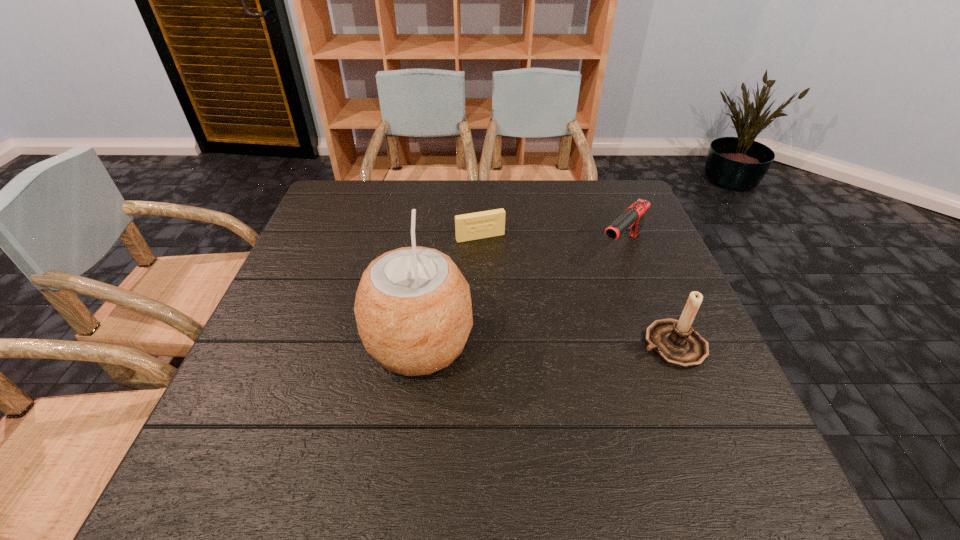
This screenshot has width=960, height=540. I want to click on vacant area that lies between the coconut and the candle holder, so click(x=546, y=343).

Find the location of a particular element. The height and width of the screenshot is (540, 960). free space between the gun and the videotape is located at coordinates (551, 242).

Where is `vacant space in between the gun and the second tallest object`? The height and width of the screenshot is (540, 960). vacant space in between the gun and the second tallest object is located at coordinates (647, 296).

Identify the location of vacant space that's between the shortest object and the candle holder. This screenshot has width=960, height=540. (576, 291).

You are a GUI agent. You are given a task and a screenshot of the screen. Output one action in this format:
    pyautogui.click(x=<x>, y=<y>)
    Task: Click on the free point between the gun and the videotape
    This screenshot has height=540, width=960.
    Given the screenshot: What is the action you would take?
    pyautogui.click(x=551, y=242)

Locate an element on the screen. This screenshot has width=960, height=540. unoccupied position between the shortest object and the candle holder is located at coordinates (576, 291).

In order to click on empty location between the candle holder and the videotape in this screenshot , I will do `click(576, 291)`.

The height and width of the screenshot is (540, 960). Find the location of `object that is the second closest one to the tallest object`. object that is the second closest one to the tallest object is located at coordinates click(x=633, y=217).

Select which object is the second closest to the gun. Please provide its 2D coordinates. Your answer should be formatted as a tuple, i.e. [(x, y)], where the tuple contains the x and y coordinates of a point satisfying the conditions above.

[(485, 224)]

Where is `vacant space that satisfies the following two spatial constraints: 1. on the back side of the coconut; 2. on the left side of the gun`? vacant space that satisfies the following two spatial constraints: 1. on the back side of the coconut; 2. on the left side of the gun is located at coordinates (432, 247).